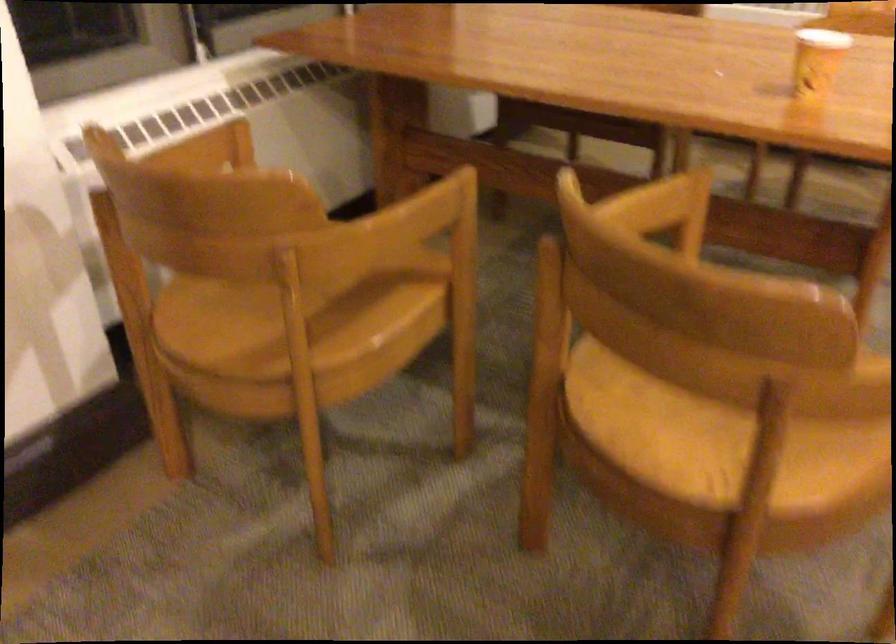
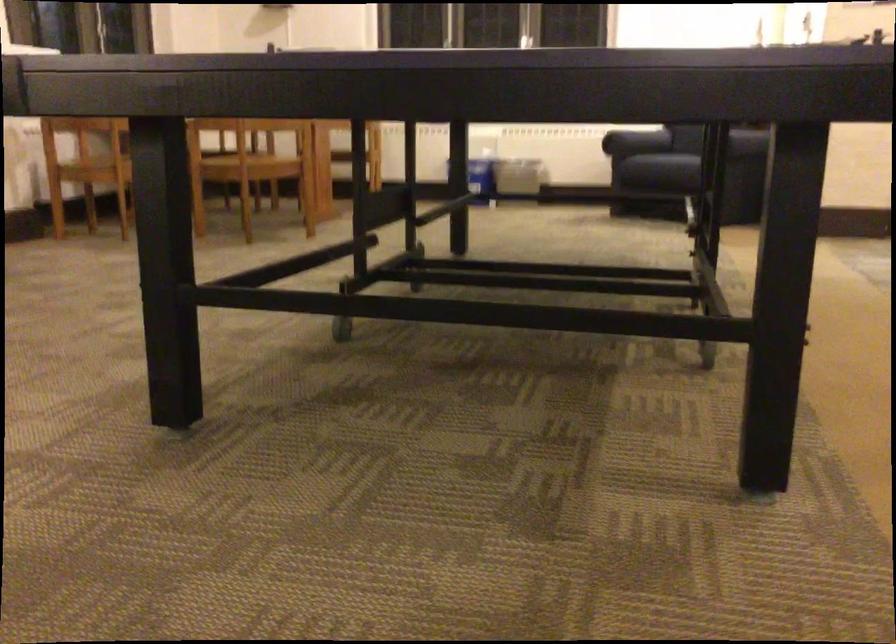
In the second image, find the point that corresponds to point 797,455 in the first image.

(248, 160)